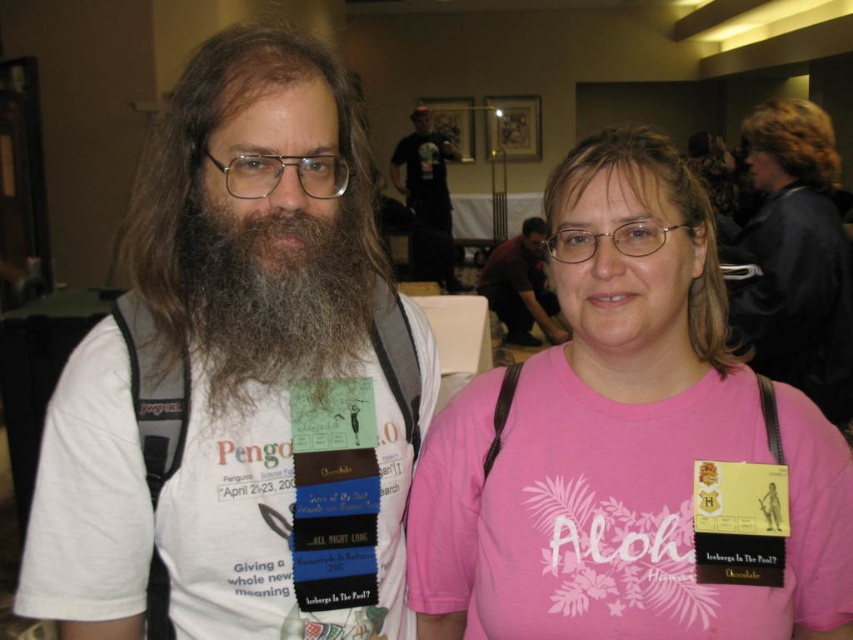
You are at a convention and need to move from your current position to the exit located at point A. There are two points marked in the scene. Point A is at the exit. The first point is at coordinates point (x=405, y=198) and the second point is at (x=556, y=337). If you want to reach the exit as quickly as possible, which point should you avoid walking through?

You should avoid walking through point (x=405, y=198) because it is behind point (x=556, y=337), which is closer to the exit at point A.